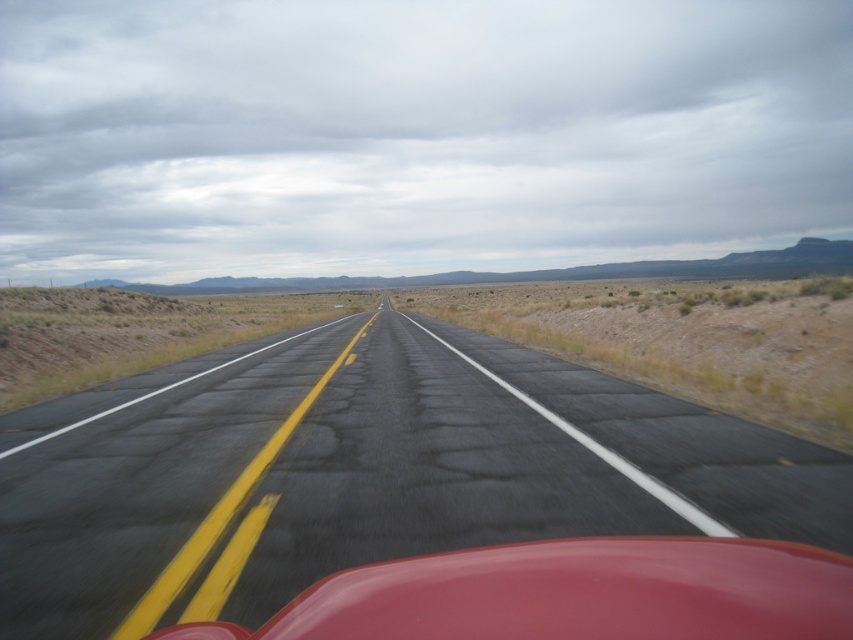
Question: Which point appears closest to the camera in this image?

Choices:
 (A) 815,600
 (B) 741,634

Answer: (B)

Question: Is asphalt road at center below glossy red car at center?

Choices:
 (A) no
 (B) yes

Answer: (A)

Question: Which point is closer to the camera?

Choices:
 (A) asphalt road at center
 (B) glossy red car at center

Answer: (B)

Question: In this image, where is asphalt road at center located relative to glossy red car at center?

Choices:
 (A) above
 (B) below

Answer: (A)

Question: Which point is farther to the camera?

Choices:
 (A) glossy red car at center
 (B) asphalt road at center

Answer: (B)

Question: Can you confirm if asphalt road at center is positioned above glossy red car at center?

Choices:
 (A) yes
 (B) no

Answer: (A)